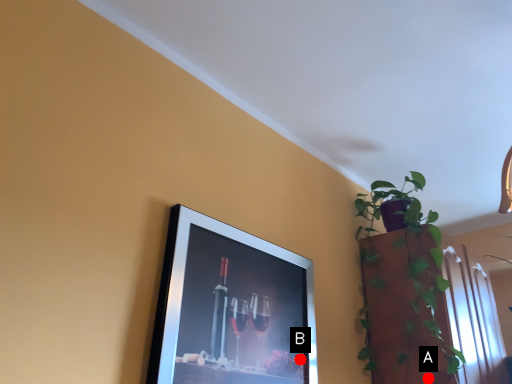
Question: Two points are circled on the image, labeled by A and B beside each circle. Which point is closer to the camera?

Choices:
 (A) A is closer
 (B) B is closer

Answer: (B)